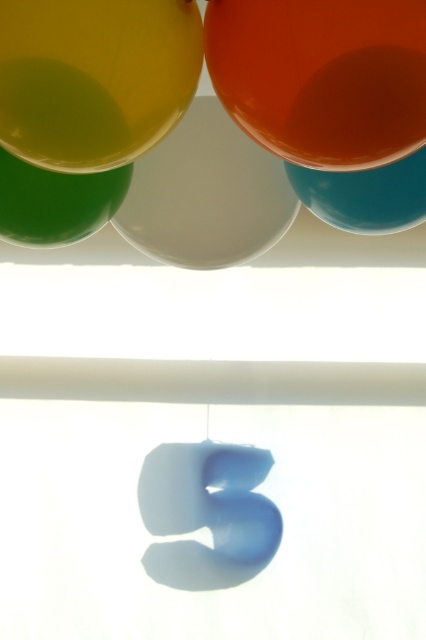
You are a child trying to decide which balloon to choose between the translucent yellow balloon at upper left and the teal glossy balloon at upper right. If you want the wider one, which should you pick?

The translucent yellow balloon at upper left might be wider than teal glossy balloon at upper right, so you should pick the translucent yellow balloon at upper left.

You are planning to arrange these balloons in a row for a party decoration. If you want to place a new pink balloon between the glossy white balloon at center and the green rubber balloon at left, where should you position it?

The glossy white balloon at center is to the right of the green rubber balloon at left. Therefore, placing the new pink balloon between them would require positioning it between the green rubber balloon at left and the glossy white balloon at center, maintaining their existing order.